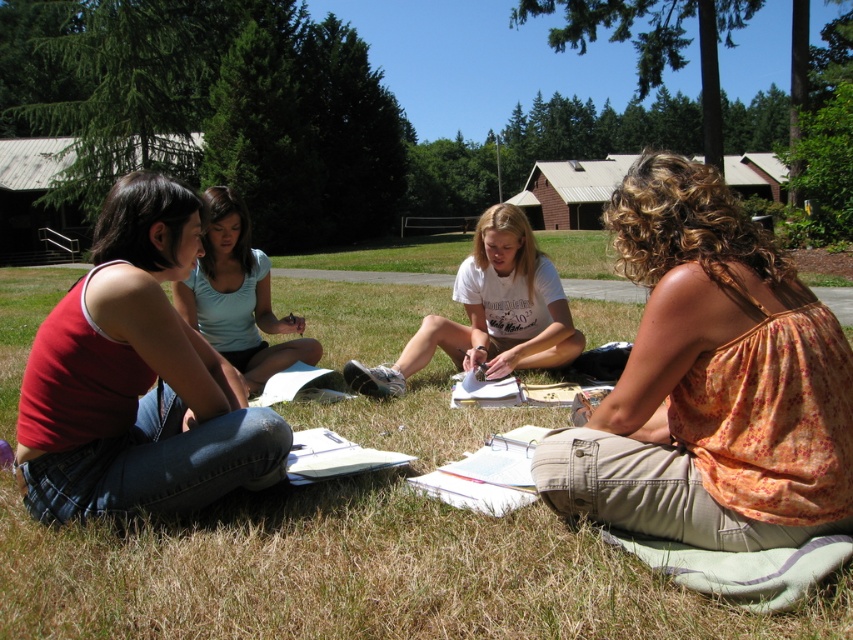
Which is more to the left, floral cotton tank top at lower right or matte red tank top at left?

Positioned to the left is matte red tank top at left.

Between floral cotton tank top at lower right and matte red tank top at left, which one is positioned higher?

Positioned higher is matte red tank top at left.

Which is in front, point (675, 481) or point (107, 413)?

Point (675, 481)

The image size is (853, 640). In order to click on floral cotton tank top at lower right in this screenshot , I will do `click(711, 384)`.

This screenshot has height=640, width=853. I want to click on green grass at lower center, so click(x=357, y=573).

Is matte red tank top at left shorter than light blue cotton shirt at center?

Indeed, matte red tank top at left has a lesser height compared to light blue cotton shirt at center.

Is point (225, 394) closer to viewer compared to point (254, 358)?

Yes, it is in front of point (254, 358).

What do you see at coordinates (136, 380) in the screenshot? I see `matte red tank top at left` at bounding box center [136, 380].

Identify the location of matte red tank top at left. (136, 380).